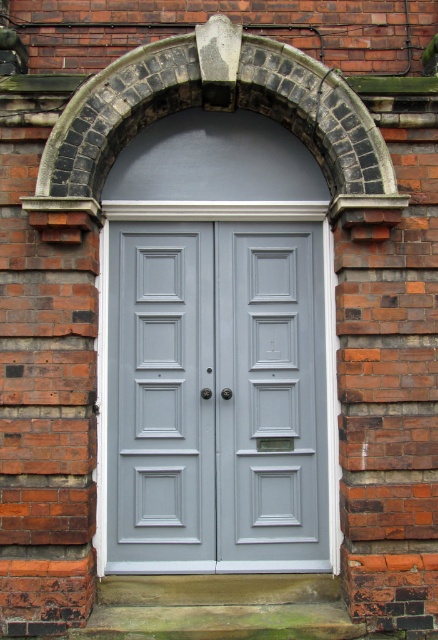
You are standing in front of the double doors within the brick archway. You notice two points marked in the scene. One is at coordinate point (212, 547) and the other at point (120, 109). From your perspective, which point is closer to you?

Point (120, 109) is closer to you because the description states that point (212, 547) is behind point (120, 109).

You are an architect assessing the symmetry of this classic architectural detail. The scene includes a satin gray door at center and a dark gray stone arch at center. Which object is taller?

The satin gray door at center is taller than the dark gray stone arch at center.

From the picture: You are a painter who needs to hang a 36 inch wide canvas between the satin gray door at center and the dark gray stone arch at center. Based on the space between them, will the canvas fit?

The satin gray door at center and dark gray stone arch at center are 35.78 inches apart, so the 36 inch wide canvas will not fit between them as the space is slightly smaller than the canvas.